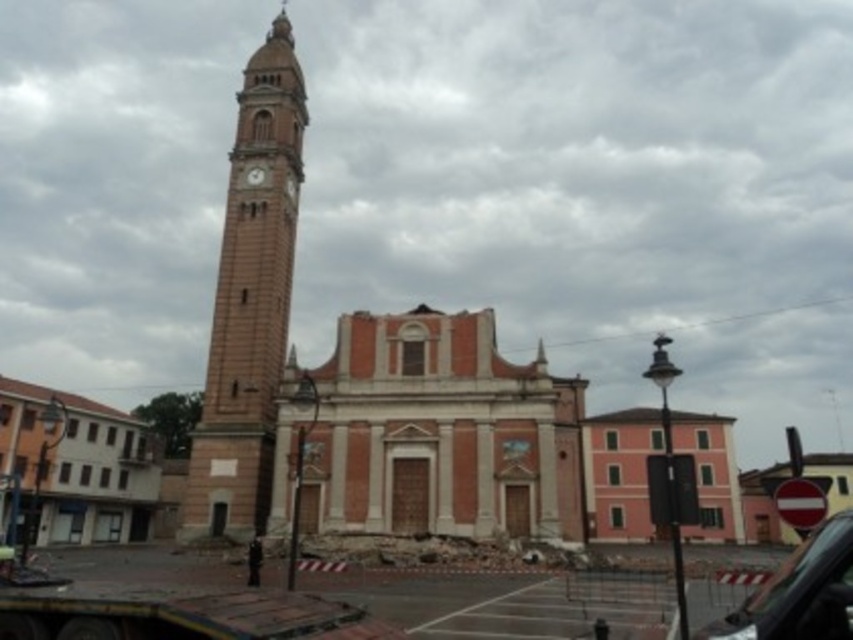
Question: Which point is closer to the camera?

Choices:
 (A) metallic clock tower at center-left
 (B) brick church at center

Answer: (B)

Question: From the image, what is the correct spatial relationship of brick church at center in relation to metallic clock tower at center-left?

Choices:
 (A) below
 (B) above

Answer: (A)

Question: Which of the following is the farthest from the observer?

Choices:
 (A) light brown stone clock tower at left
 (B) brick church at center
 (C) light brown stone clock tower at upper left
 (D) metallic clock tower at center-left

Answer: (C)

Question: Can you confirm if brick church at center is positioned above light brown stone clock tower at left?

Choices:
 (A) yes
 (B) no

Answer: (B)

Question: Observing the image, what is the correct spatial positioning of brick church at center in reference to light brown stone clock tower at upper left?

Choices:
 (A) left
 (B) right

Answer: (B)

Question: Which object is farther from the camera taking this photo?

Choices:
 (A) black glossy car at center
 (B) brick church at center
 (C) light brown stone clock tower at upper left
 (D) metallic clock tower at center-left

Answer: (C)